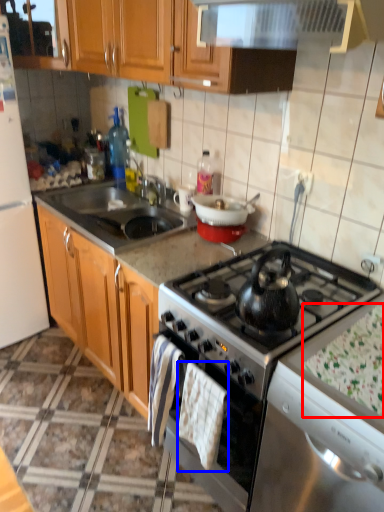
Question: Which object is further to the camera taking this photo, food (highlighted by a red box) or hand towel (highlighted by a blue box)?

Choices:
 (A) food
 (B) hand towel

Answer: (B)